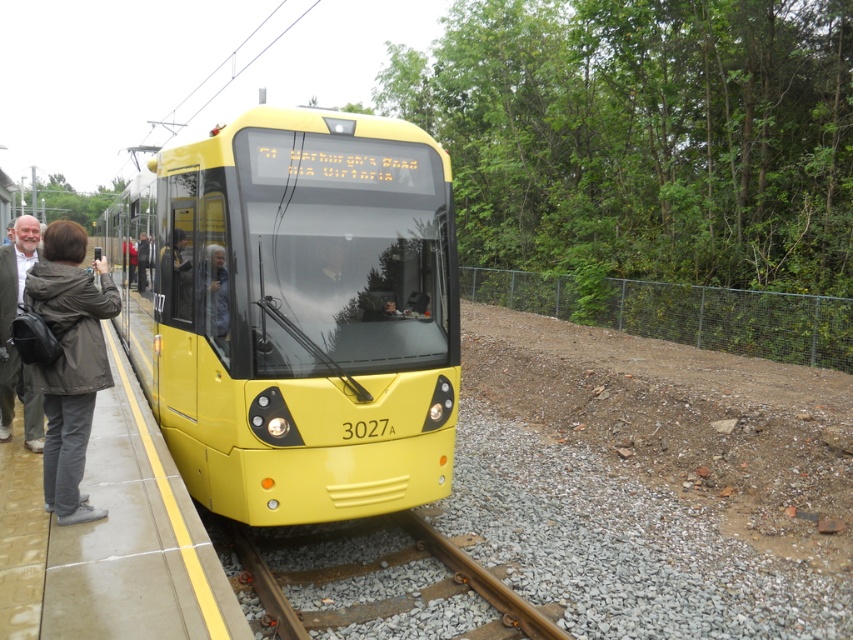
You are a passenger waiting at the station platform. The tram you need to board is the yellow matte train at center. If you are currently standing at the platform to the left of the tram, which direction should you walk to reach the tram?

Since the yellow matte train at center is positioned at point (294, 312), you should walk towards the right from your current position on the platform to reach it.

You are a photographer standing on the platform. You want to capture the brown wooden train track at center and the dark gray fabric jacket at left in the same frame. Which object should you position closer to the edge of the camera frame to ensure both are fully visible?

Since the brown wooden train track at center is wider than the dark gray fabric jacket at left, you should position the brown wooden train track at center closer to the edge of the camera frame to ensure both objects fit within the frame.